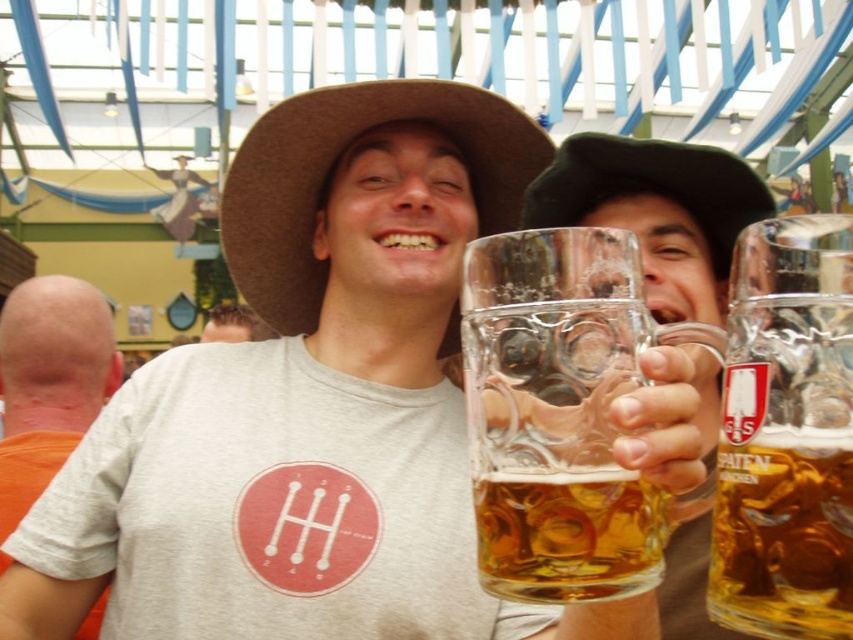
You are a photographer at the event and want to capture a photo that includes both the brown felt cowboy hat at center and the person on the left. Where should you position your camera relative to the point at coordinates point (x=334, y=172) to ensure both subjects are in frame?

The point at coordinates (x=334, y=172) corresponds to the brown felt cowboy hat at center. To include both the hat and the person on the left in the frame, position the camera to the left of this point so that the camera can capture the hat at center and the person on the left simultaneously.

From the picture: You are standing in the middle of the scene and see the point at coordinates (49, 381). What color fabric is this point located on?

The point at coordinates (49, 381) is located on orange fabric at left.

You are at a festival and want to take a photo of both the person on the left and the person on the right. You notice two points in the image labeled as point 1 at coordinates point (x=496, y=182) and point 2 at coordinates point (x=42, y=284). Which point is closer to you so you can focus your camera properly?

Point 1 at coordinates point (x=496, y=182) is closer to the viewer than point 2 at coordinates point (x=42, y=284), so focus on that point first.